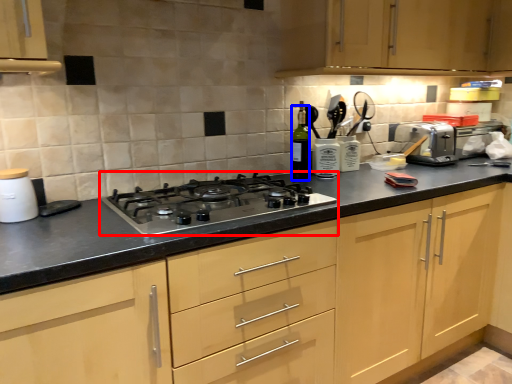
Question: Which object is further to the camera taking this photo, gas stove (highlighted by a red box) or bottle (highlighted by a blue box)?

Choices:
 (A) gas stove
 (B) bottle

Answer: (B)